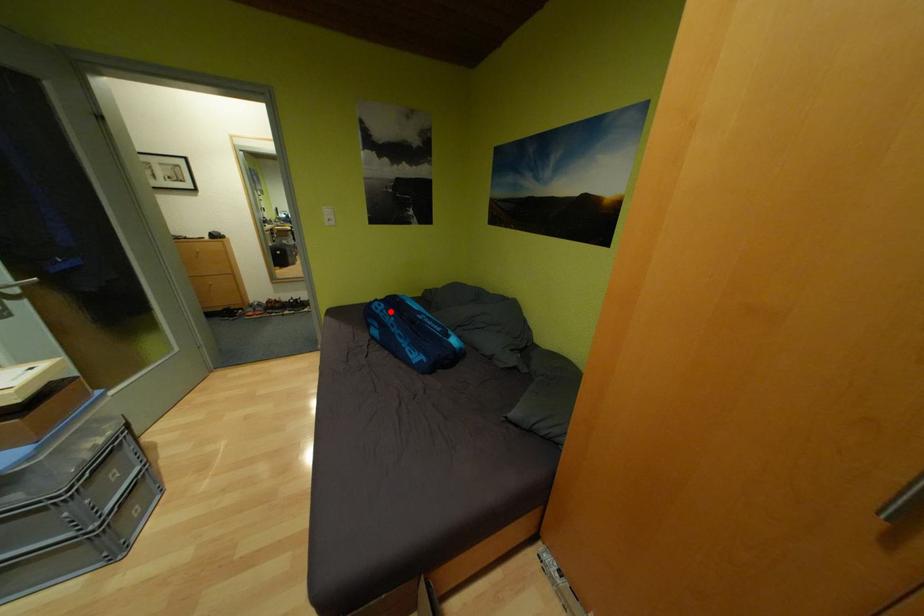
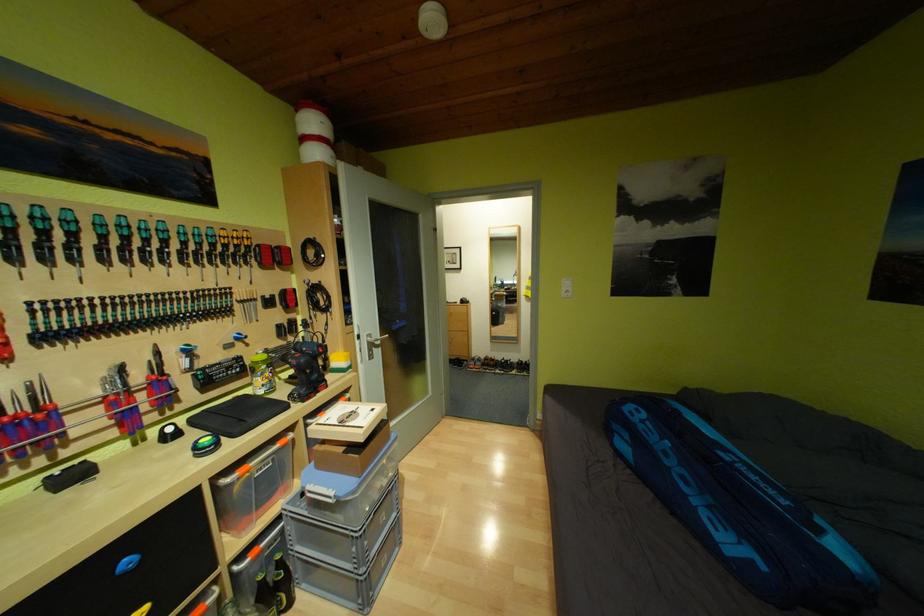
The point at the highlighted location is marked in the first image. Where is the corresponding point in the second image?

(651, 422)